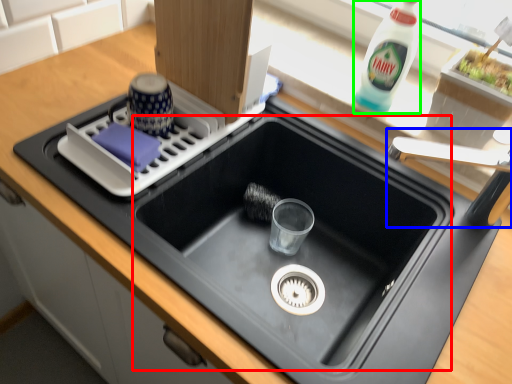
Question: Which is nearer to the sink (highlighted by a red box)? faucet (highlighted by a blue box) or bottle (highlighted by a green box).

Choices:
 (A) faucet
 (B) bottle

Answer: (A)